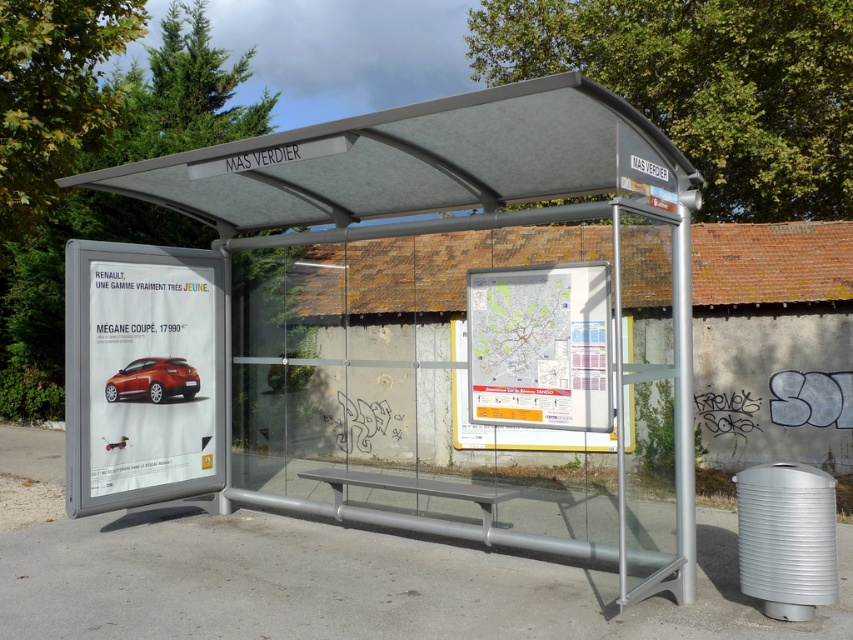
Question: Is matte red car at left bigger than shiny red car at center?

Choices:
 (A) yes
 (B) no

Answer: (A)

Question: Which point is closer to the camera?

Choices:
 (A) (602, 346)
 (B) (112, 381)

Answer: (A)

Question: Can you confirm if matte plastic map at center is positioned to the left of shiny red car at center?

Choices:
 (A) yes
 (B) no

Answer: (B)

Question: Which object is farther from the camera taking this photo?

Choices:
 (A) matte red car at left
 (B) matte plastic map at center
 (C) matte gray canopy at center
 (D) metallic silver bus station at center

Answer: (A)

Question: Among these objects, which one is nearest to the camera?

Choices:
 (A) matte red car at left
 (B) matte plastic map at center

Answer: (B)

Question: Is matte gray canopy at center below matte plastic map at center?

Choices:
 (A) yes
 (B) no

Answer: (B)